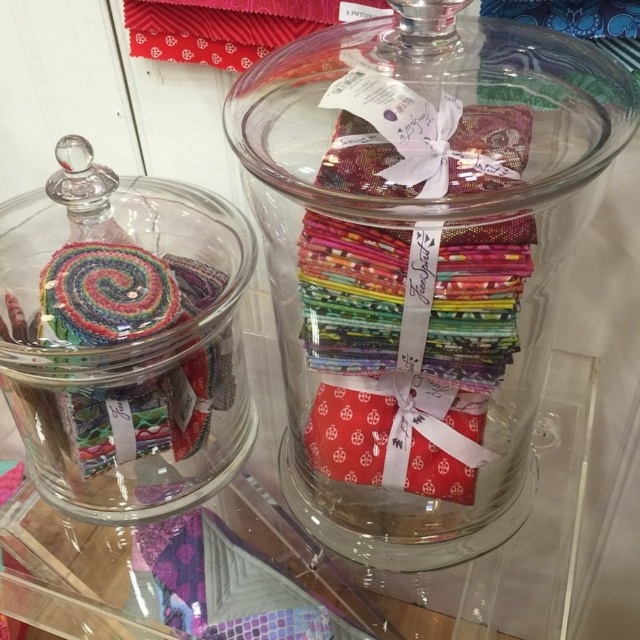
Question: Which point is farther to the camera?

Choices:
 (A) (598, 49)
 (B) (220, 202)

Answer: (B)

Question: Does transparent glass jar at center appear on the left side of multicolored fabric at left?

Choices:
 (A) no
 (B) yes

Answer: (A)

Question: Can you confirm if transparent glass jar at center is positioned to the left of multicolored fabric at left?

Choices:
 (A) yes
 (B) no

Answer: (B)

Question: Can you confirm if transparent glass jar at center is wider than multicolored fabric at left?

Choices:
 (A) no
 (B) yes

Answer: (B)